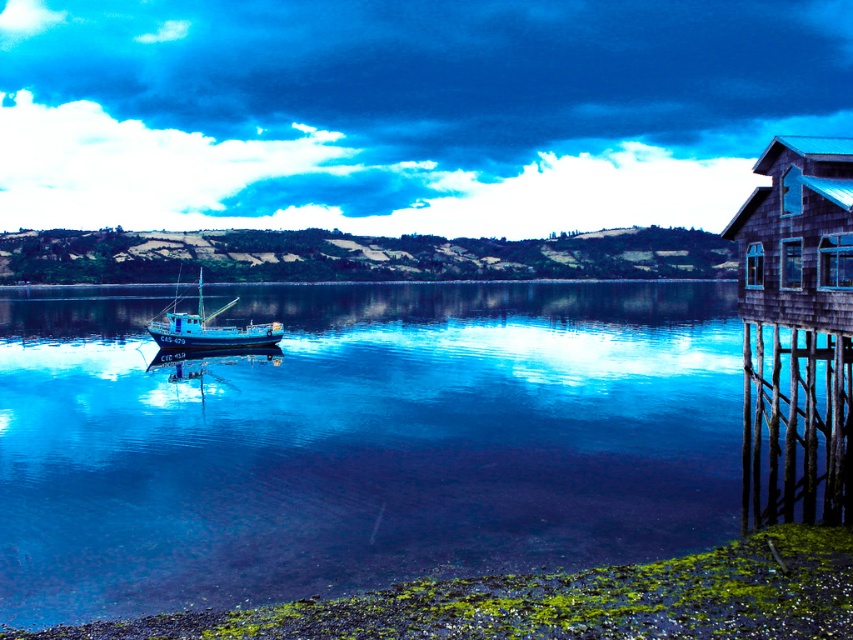
Question: Observing the image, what is the correct spatial positioning of transparent blue water at center in reference to wooden cabin at right?

Choices:
 (A) right
 (B) left

Answer: (B)

Question: Which point is closer to the camera?

Choices:
 (A) (778, 288)
 (B) (711, 392)
 (C) (183, 323)

Answer: (A)

Question: Does green mossy gravel at lower left have a lesser width compared to blue matte fishing boat at center?

Choices:
 (A) no
 (B) yes

Answer: (B)

Question: Does transparent blue water at center lie in front of green mossy gravel at lower left?

Choices:
 (A) yes
 (B) no

Answer: (B)

Question: Which of these objects is positioned closest to the wooden cabin at right?

Choices:
 (A) transparent blue water at center
 (B) green mossy gravel at lower left
 (C) blue matte fishing boat at center

Answer: (B)

Question: Among these objects, which one is nearest to the camera?

Choices:
 (A) blue matte fishing boat at center
 (B) wooden cabin at right
 (C) green mossy gravel at lower left

Answer: (C)